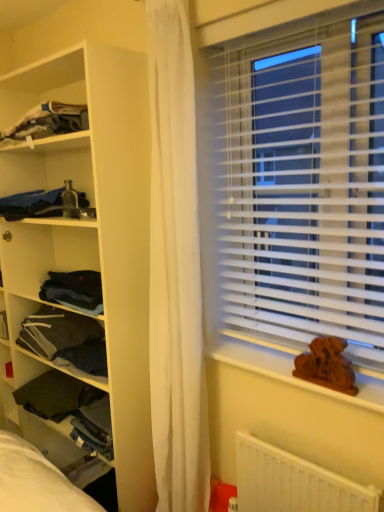
What is the approximate height of white plastic radiator at lower right?

white plastic radiator at lower right is 16.33 inches in height.

Describe the element at coordinates (48, 121) in the screenshot. I see `dark blue fabric at upper left, acting as the 4th clothing starting from the bottom` at that location.

Locate an element on the screen. This screenshot has height=512, width=384. dark gray fabric at left, the 3th clothing from the top is located at coordinates (65, 339).

What do you see at coordinates (291, 372) in the screenshot? Image resolution: width=384 pixels, height=512 pixels. I see `wooden carving at lower right` at bounding box center [291, 372].

The image size is (384, 512). In order to click on white plastic radiator at lower right in this screenshot , I will do `click(294, 483)`.

Can you confirm if white plastic blinds at right is thinner than dark green fabric at left, acting as the 1th clothing starting from the bottom?

Yes.

Is the position of white plastic blinds at right more distant than that of dark green fabric at left, acting as the fourth clothing starting from the top?

No, white plastic blinds at right is in front of dark green fabric at left, acting as the fourth clothing starting from the top.

Is white plastic blinds at right inside or outside of dark green fabric at left, acting as the 1th clothing starting from the bottom?

white plastic blinds at right is not enclosed by dark green fabric at left, acting as the 1th clothing starting from the bottom.

Is dark green fabric at left, acting as the 1th clothing starting from the bottom, at the back of white plastic blinds at right?

No, dark green fabric at left, acting as the 1th clothing starting from the bottom, is not at the back of white plastic blinds at right.

Is dark blue fabric at upper left, arranged as the 1th clothing when viewed from the top, far from white plastic radiator at lower right?

Absolutely, dark blue fabric at upper left, arranged as the 1th clothing when viewed from the top, is distant from white plastic radiator at lower right.

Considering the positions of objects dark blue fabric at upper left, arranged as the 1th clothing when viewed from the top, and white plastic radiator at lower right in the image provided, who is more to the left, dark blue fabric at upper left, arranged as the 1th clothing when viewed from the top, or white plastic radiator at lower right?

dark blue fabric at upper left, arranged as the 1th clothing when viewed from the top, is more to the left.

Based on the photo, from the image's perspective, which object appears higher, dark blue fabric at upper left, arranged as the 1th clothing when viewed from the top, or white plastic radiator at lower right?

From the image's view, dark blue fabric at upper left, arranged as the 1th clothing when viewed from the top, is above.

Which is behind, point (80, 116) or point (249, 457)?

Positioned behind is point (80, 116).

Is dark gray fabric at left, placed as the 2th clothing when sorted from bottom to top, not inside dark blue fabric at upper left, arranged as the 1th clothing when viewed from the top?

dark gray fabric at left, placed as the 2th clothing when sorted from bottom to top, lies outside dark blue fabric at upper left, arranged as the 1th clothing when viewed from the top,'s area.

Is dark gray fabric at left, placed as the 2th clothing when sorted from bottom to top, positioned far away from dark blue fabric at upper left, arranged as the 1th clothing when viewed from the top?

dark gray fabric at left, placed as the 2th clothing when sorted from bottom to top, is near dark blue fabric at upper left, arranged as the 1th clothing when viewed from the top, not far away.

Would you say dark gray fabric at left, placed as the 2th clothing when sorted from bottom to top, is to the left or to the right of dark blue fabric at upper left, acting as the 4th clothing starting from the bottom, in the picture?

dark gray fabric at left, placed as the 2th clothing when sorted from bottom to top, is positioned on dark blue fabric at upper left, acting as the 4th clothing starting from the bottom,'s right side.

In the scene shown: Considering the sizes of objects dark gray fabric at left, the 3th clothing from the top, and dark blue fabric at upper left, arranged as the 1th clothing when viewed from the top, in the image provided, who is bigger, dark gray fabric at left, the 3th clothing from the top, or dark blue fabric at upper left, arranged as the 1th clothing when viewed from the top,?

Bigger between the two is dark gray fabric at left, the 3th clothing from the top.

How different are the orientations of white matte shelf at left and matte black bottle at left, acting as the third clothing starting from the bottom, in degrees?

The facing directions of white matte shelf at left and matte black bottle at left, acting as the third clothing starting from the bottom, are 0.707 degrees apart.

Is white matte shelf at left placed right next to matte black bottle at left, acting as the third clothing starting from the bottom?

No, white matte shelf at left is not with matte black bottle at left, acting as the third clothing starting from the bottom.

Locate an element on the screen. The image size is (384, 512). shelf that appears below the matte black bottle at left, positioned as the second clothing in top-to-bottom order (from a real-world perspective) is located at coordinates (90, 229).

Is white plastic blinds at right positioned behind white matte shelf at left?

No, white plastic blinds at right is closer to the viewer.

Is white matte shelf at left surrounded by white plastic blinds at right?

That's incorrect, white matte shelf at left is not inside white plastic blinds at right.

Considering the relative sizes of white plastic blinds at right and white matte shelf at left in the image provided, is white plastic blinds at right taller than white matte shelf at left?

No.

Do you think white matte shelf at left is within white plastic blinds at right, or outside of it?

white matte shelf at left is not enclosed by white plastic blinds at right.

The width and height of the screenshot is (384, 512). Identify the location of shelf lying on the left of white plastic blinds at right. (90, 229).

What's the angular difference between white matte shelf at left and white plastic blinds at right's facing directions?

The angular difference between white matte shelf at left and white plastic blinds at right is 1.12 degrees.

Looking at this image, can you confirm if white matte shelf at left is smaller than white plastic blinds at right?

Actually, white matte shelf at left might be larger than white plastic blinds at right.

From a real-world perspective, is dark green fabric at left, acting as the fourth clothing starting from the top, under white plastic radiator at lower right?

No, from a real-world perspective, dark green fabric at left, acting as the fourth clothing starting from the top, is not under white plastic radiator at lower right.

Can you confirm if dark green fabric at left, acting as the fourth clothing starting from the top, is taller than white plastic radiator at lower right?

No, dark green fabric at left, acting as the fourth clothing starting from the top, is not taller than white plastic radiator at lower right.

Looking at the image, does dark green fabric at left, acting as the 1th clothing starting from the bottom, seem bigger or smaller compared to white plastic radiator at lower right?

Clearly, dark green fabric at left, acting as the 1th clothing starting from the bottom, is larger in size than white plastic radiator at lower right.

From the white plastic blinds at right, count 4th clothings backward and point to it. Please provide its 2D coordinates.

[(71, 408)]

In order to click on the 4th clothing above the white plastic radiator at lower right (from the image's perspective) in this screenshot , I will do `click(48, 121)`.

From the image, which object appears to be farther from white matte shelf at left, dark gray fabric at left, placed as the 2th clothing when sorted from bottom to top, or white plastic blinds at right?

white plastic blinds at right lies further to white matte shelf at left than the other object.

From the image, which object appears to be nearer to white plastic radiator at lower right, dark blue fabric at upper left, acting as the 4th clothing starting from the bottom, or wooden carving at lower right?

wooden carving at lower right is positioned closer to the anchor white plastic radiator at lower right.

Estimate the real-world distances between objects in this image. Which object is further from dark blue fabric at upper left, arranged as the 1th clothing when viewed from the top, white matte shelf at left or wooden carving at lower right?

wooden carving at lower right is further to dark blue fabric at upper left, arranged as the 1th clothing when viewed from the top.

Estimate the real-world distances between objects in this image. Which object is further from white matte shelf at left, dark gray fabric at left, placed as the 2th clothing when sorted from bottom to top, or wooden carving at lower right?

wooden carving at lower right.

Estimate the real-world distances between objects in this image. Which object is further from dark blue fabric at upper left, acting as the 4th clothing starting from the bottom, dark green fabric at left, acting as the fourth clothing starting from the top, or wooden carving at lower right?

Based on the image, dark green fabric at left, acting as the fourth clothing starting from the top, appears to be further to dark blue fabric at upper left, acting as the 4th clothing starting from the bottom.

Which object lies further to the anchor point dark blue fabric at upper left, arranged as the 1th clothing when viewed from the top, white plastic radiator at lower right or white plastic blinds at right?

white plastic radiator at lower right is further to dark blue fabric at upper left, arranged as the 1th clothing when viewed from the top.

Based on their spatial positions, is white matte shelf at left or dark green fabric at left, acting as the fourth clothing starting from the top, further from dark gray fabric at left, placed as the 2th clothing when sorted from bottom to top?

Among the two, white matte shelf at left is located further to dark gray fabric at left, placed as the 2th clothing when sorted from bottom to top.

Based on their spatial positions, is white plastic radiator at lower right or dark blue fabric at upper left, acting as the 4th clothing starting from the bottom, closer to dark green fabric at left, acting as the fourth clothing starting from the top?

white plastic radiator at lower right lies closer to dark green fabric at left, acting as the fourth clothing starting from the top, than the other object.

Identify the location of window blind between dark blue fabric at upper left, arranged as the 1th clothing when viewed from the top, and wooden carving at lower right. (294, 177).

The width and height of the screenshot is (384, 512). I want to click on shelf located between dark gray fabric at left, placed as the 2th clothing when sorted from bottom to top, and wooden carving at lower right in the left-right direction, so click(x=90, y=229).

Locate an element on the screen. shelf between matte black bottle at left, positioned as the second clothing in top-to-bottom order, and white plastic radiator at lower right is located at coordinates (90, 229).

I want to click on clothing between dark green fabric at left, acting as the 1th clothing starting from the bottom, and wooden carving at lower right, in the horizontal direction, so click(x=65, y=339).